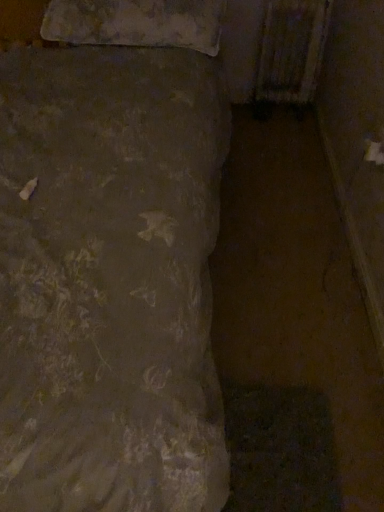
Question: Is rusty metal radiator at upper right to the left or to the right of textured beige pillow at upper left in the image?

Choices:
 (A) left
 (B) right

Answer: (B)

Question: From the image's perspective, is rusty metal radiator at upper right positioned above or below textured beige pillow at upper left?

Choices:
 (A) below
 (B) above

Answer: (B)

Question: Is rusty metal radiator at upper right inside the boundaries of textured beige pillow at upper left, or outside?

Choices:
 (A) outside
 (B) inside

Answer: (A)

Question: Is textured beige pillow at upper left bigger or smaller than rusty metal radiator at upper right?

Choices:
 (A) big
 (B) small

Answer: (A)

Question: Relative to rusty metal radiator at upper right, is textured beige pillow at upper left in front or behind?

Choices:
 (A) front
 (B) behind

Answer: (A)

Question: From the image's perspective, relative to rusty metal radiator at upper right, is textured beige pillow at upper left above or below?

Choices:
 (A) below
 (B) above

Answer: (A)

Question: Do you think textured beige pillow at upper left is within rusty metal radiator at upper right, or outside of it?

Choices:
 (A) outside
 (B) inside

Answer: (A)